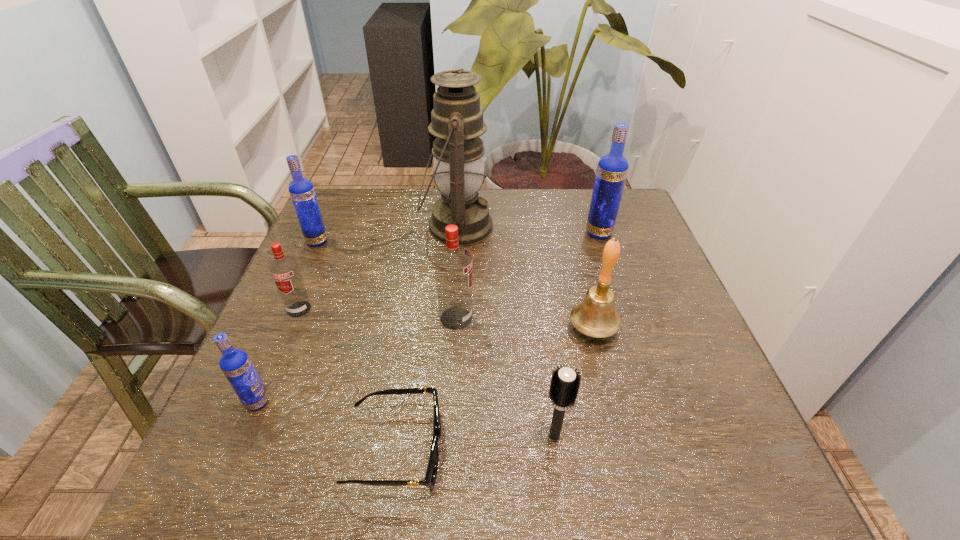
Locate an element on the screen. The image size is (960, 540). vacant region located 0.180m on the left of the seventh object from left to right is located at coordinates (436, 436).

At what (x,y) coordinates should I click in order to perform the action: click on free space located 0.210m on the front-facing side of the black sunglasses. Please return your answer as a coordinate pair (x, y). The image size is (960, 540). Looking at the image, I should click on (568, 449).

The image size is (960, 540). Identify the location of oil lamp located at the far edge. (457, 122).

Where is `hairbrush at the near edge`? hairbrush at the near edge is located at coordinates (564, 386).

The height and width of the screenshot is (540, 960). I want to click on sunglasses located in the near edge section of the desktop, so click(431, 473).

Locate an element on the screen. This screenshot has height=540, width=960. vodka that is at the right edge is located at coordinates (612, 169).

The image size is (960, 540). I want to click on bell that is at the right edge, so click(x=596, y=316).

The height and width of the screenshot is (540, 960). What are the coordinates of `object that is at the far left corner` in the screenshot? It's located at (301, 190).

This screenshot has width=960, height=540. In order to click on object at the far right corner in this screenshot , I will do `click(612, 169)`.

Locate an element on the screen. Image resolution: width=960 pixels, height=540 pixels. free spot at the far edge of the desktop is located at coordinates (568, 194).